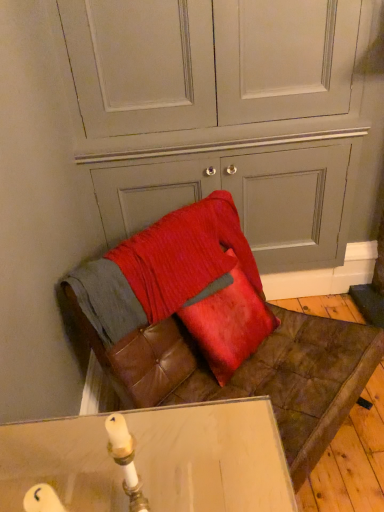
Question: Do you think leather cushion at lower center is within leather cushion at lower center, or outside of it?

Choices:
 (A) outside
 (B) inside

Answer: (A)

Question: Is leather cushion at lower center taller or shorter than leather cushion at lower center?

Choices:
 (A) short
 (B) tall

Answer: (B)

Question: Based on their relative distances, which object is nearer to the leather cushion at lower center?

Choices:
 (A) satin red pillow at center
 (B) leather cushion at lower center

Answer: (A)

Question: Estimate the real-world distances between objects in this image. Which object is closer to the satin red pillow at center?

Choices:
 (A) leather cushion at lower center
 (B) leather cushion at lower center

Answer: (B)